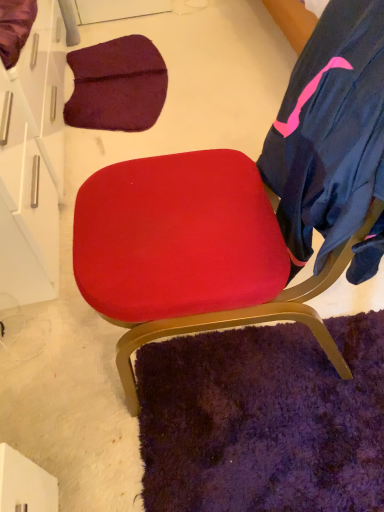
Image resolution: width=384 pixels, height=512 pixels. I want to click on suede red chair at center, so click(x=191, y=252).

Where is `suede red chair at center`? This screenshot has height=512, width=384. suede red chair at center is located at coordinates (191, 252).

How different are the orientations of white glossy drawer at upper left and suede red chair at center in degrees?

178 degrees separate the facing orientations of white glossy drawer at upper left and suede red chair at center.

Between white glossy drawer at upper left and suede red chair at center, which one appears on the right side from the viewer's perspective?

Positioned to the right is suede red chair at center.

In the scene shown: Is suede red chair at center at the back of white glossy drawer at upper left?

No.

From a real-world perspective, who is located higher, white glossy drawer at upper left or suede red chair at center?

In real-world perspective, suede red chair at center is above.

Considering the positions of point (1, 75) and point (341, 110), is point (1, 75) closer or farther from the camera than point (341, 110)?

Point (1, 75) is farther from the camera than point (341, 110).

Is white glossy drawer at upper left turned away from dark blue fabric robe at right?

No, white glossy drawer at upper left's orientation is not away from dark blue fabric robe at right.

Is white glossy drawer at upper left with dark blue fabric robe at right?

No, white glossy drawer at upper left is not touching dark blue fabric robe at right.

Does dark blue fabric robe at right have a greater height compared to white glossy drawer at upper left?

Yes.

From the image's perspective, is dark blue fabric robe at right above or below white glossy drawer at upper left?

From the image's perspective, dark blue fabric robe at right appears below white glossy drawer at upper left.

Is the surface of dark blue fabric robe at right in direct contact with white glossy drawer at upper left?

They are not placed beside each other.

Is dark blue fabric robe at right at the right side of white glossy drawer at upper left?

Yes, dark blue fabric robe at right is to the right of white glossy drawer at upper left.

Is dark blue fabric robe at right not near suede red chair at center?

No, dark blue fabric robe at right is in close proximity to suede red chair at center.

Measure the distance between dark blue fabric robe at right and suede red chair at center.

7.01 inches.

Is dark blue fabric robe at right positioned behind suede red chair at center?

Yes.

Is dark blue fabric robe at right to the left of suede red chair at center from the viewer's perspective?

No.

You are a GUI agent. You are given a task and a screenshot of the screen. Output one action in this format:
    pyautogui.click(x=<x>, y=<y>)
    Task: Click on the robe above the suede red chair at center (from a real-world perspective)
    Image resolution: width=384 pixels, height=512 pixels.
    Given the screenshot: What is the action you would take?
    pyautogui.click(x=329, y=130)

From a real-world perspective, does suede red chair at center stand above dark blue fabric robe at right?

Actually, suede red chair at center is physically below dark blue fabric robe at right in the real world.

Which object is more forward, suede red chair at center or dark blue fabric robe at right?

suede red chair at center is closer to the camera.

From the picture: From the image's perspective, is suede red chair at center over white glossy drawer at upper left?

No, from the image's perspective, suede red chair at center is not on top of white glossy drawer at upper left.

Would you say suede red chair at center is a long distance from white glossy drawer at upper left?

No.

Which is nearer, [256,201] or [62,127]?

Point [256,201].

Identify the location of chair above the white glossy drawer at upper left (from a real-world perspective). (191, 252).

Image resolution: width=384 pixels, height=512 pixels. I want to click on robe in front of the white glossy drawer at upper left, so 329,130.

Estimate the real-world distances between objects in this image. Which object is closer to dark blue fabric robe at right, suede red chair at center or white glossy drawer at upper left?

suede red chair at center.

Estimate the real-world distances between objects in this image. Which object is closer to suede red chair at center, dark blue fabric robe at right or white glossy drawer at upper left?

The object closer to suede red chair at center is dark blue fabric robe at right.

Considering their positions, is white glossy drawer at upper left positioned closer to dark blue fabric robe at right than suede red chair at center?

suede red chair at center is closer to dark blue fabric robe at right.

Based on their spatial positions, is dark blue fabric robe at right or suede red chair at center closer to white glossy drawer at upper left?

suede red chair at center.

From the image, which object appears to be farther from white glossy drawer at upper left, suede red chair at center or dark blue fabric robe at right?

The object further to white glossy drawer at upper left is dark blue fabric robe at right.

Which object lies further to the anchor point suede red chair at center, white glossy drawer at upper left or dark blue fabric robe at right?

white glossy drawer at upper left.

Find the location of a particular element. This screenshot has height=512, width=384. chair between white glossy drawer at upper left and dark blue fabric robe at right is located at coordinates (191, 252).